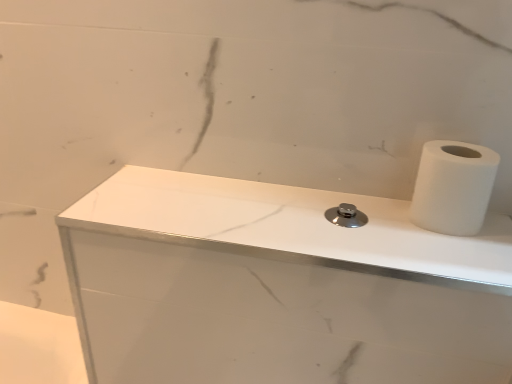
Locate an element on the screen. This screenshot has width=512, height=384. free space above white marble counter top at center (from a real-world perspective) is located at coordinates (298, 217).